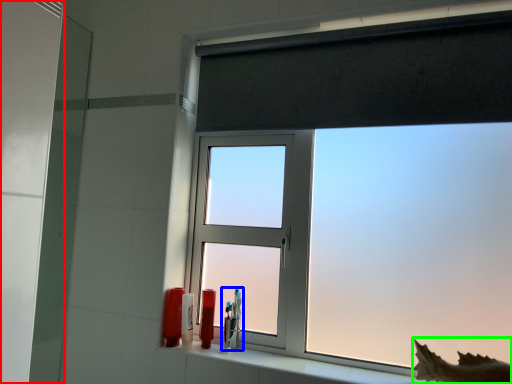
Question: Which is nearer to the screen door (highlighted by a red box)? toiletry (highlighted by a blue box) or animal (highlighted by a green box).

Choices:
 (A) toiletry
 (B) animal

Answer: (A)